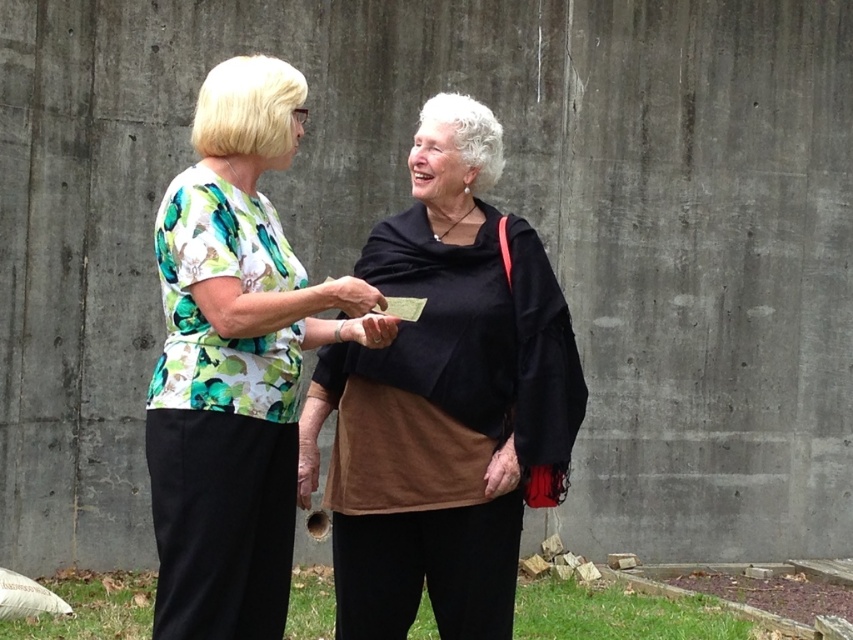
You are a photographer trying to capture the interaction between the two women in the scene. You notice the printed fabric blouse at center and the matte black hand at center. Which object is closer to the camera lens?

The matte black hand at center is closer to the camera lens because it is positioned over the printed fabric blouse at center.

You are a photographer standing at a distance. You want to take a closeup photo of the printed fabric blouse at center. Based on the scene description, can you estimate if you need to move closer or farther away to achieve a clear closeup?

The printed fabric blouse at center is 3.34 meters from viewer. To take a closeup photo, you would need to move closer than 3.34 meters to get a clearer image.

You are a photographer trying to capture a closeup shot of the black suede shawl at center and the smooth skin hand at center. Since you want to focus on the details of both objects, which one should you zoom in on more to ensure both are in focus?

You should zoom in more on the black suede shawl at center because it is larger than the smooth skin hand at center, allowing both to be in focus when prioritizing the larger object.